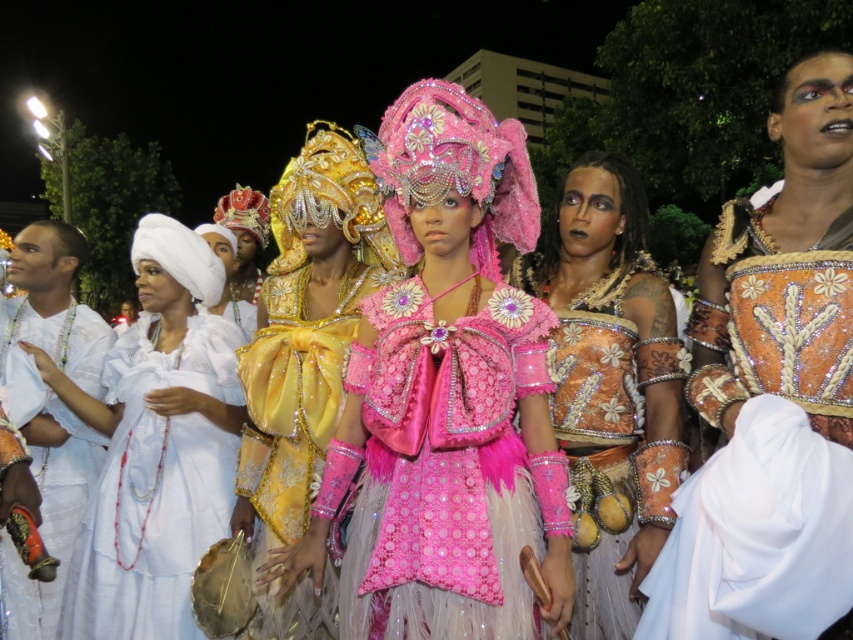
Question: Which point is closer to the camera?

Choices:
 (A) (347, 372)
 (B) (573, 369)
 (C) (177, 449)
 (D) (280, 282)

Answer: (B)

Question: Is the position of shiny pink fabric at center less distant than that of shiny pink fabric dress at center?

Choices:
 (A) no
 (B) yes

Answer: (B)

Question: Considering the relative positions of shiny pink fabric at center and white satin dress at center in the image provided, where is shiny pink fabric at center located with respect to white satin dress at center?

Choices:
 (A) left
 (B) right

Answer: (B)

Question: Which of the following is the farthest from the observer?

Choices:
 (A) (144, 449)
 (B) (315, 632)
 (C) (415, 259)
 (D) (627, 502)

Answer: (A)

Question: Does shiny pink fabric at center appear on the left side of white satin dress at left?

Choices:
 (A) yes
 (B) no

Answer: (B)

Question: Which point is farther to the camera?

Choices:
 (A) white satin dress at center
 (B) shiny gold dress at center

Answer: (A)